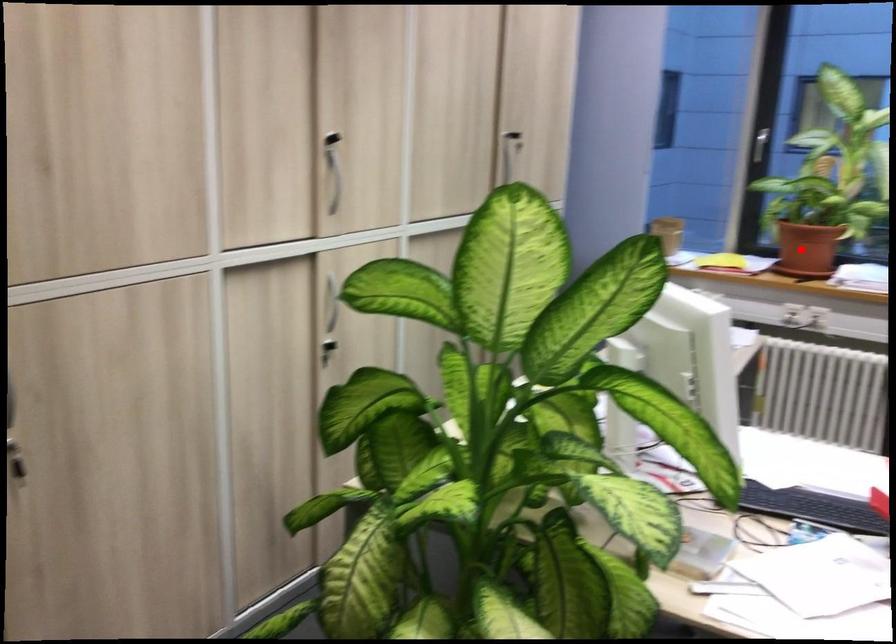
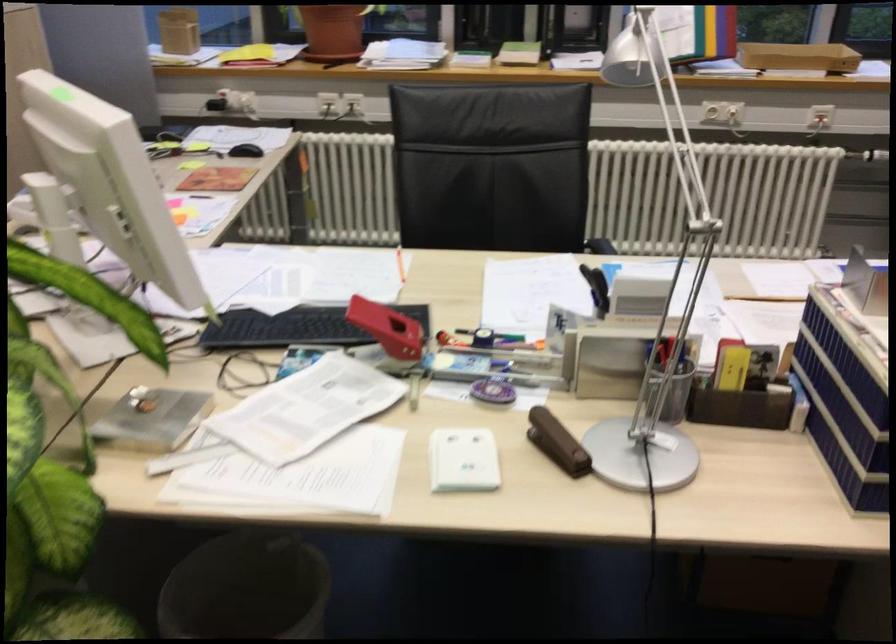
Question: I am providing you with two images of the same scene from different viewpoints. A red point is shown in image1. For the corresponding object point in image2, is it positioned nearer or farther from the camera?

Choices:
 (A) Nearer
 (B) Farther

Answer: (A)